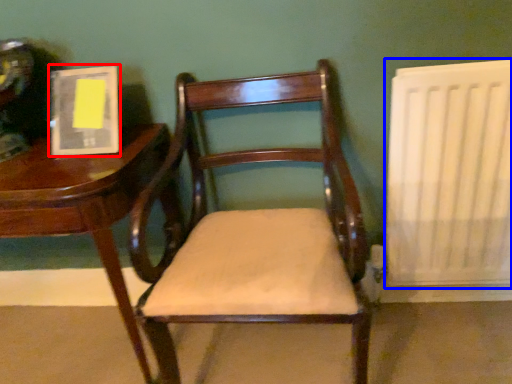
Question: Which object appears closest to the camera in this image, book (highlighted by a red box) or radiator (highlighted by a blue box)?

Choices:
 (A) book
 (B) radiator

Answer: (B)